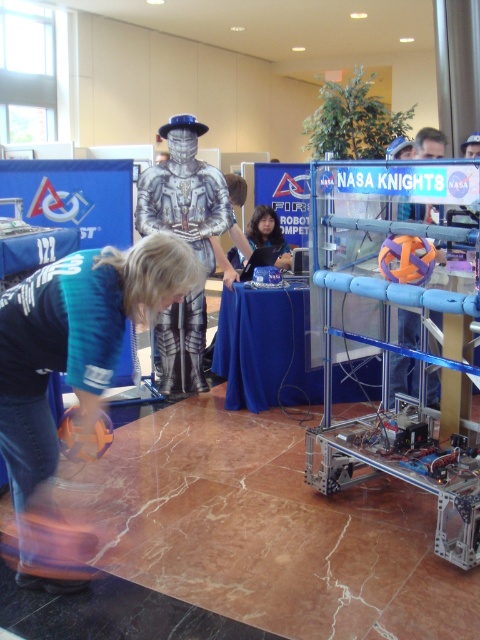
You are a judge at the robotics competition and need to determine if the orange matte ball at center can fit through a hoop that is just large enough for the smooth black hair at center. Can it pass through?

The orange matte ball at center is larger in size than smooth black hair at center, so it cannot pass through the hoop that fits the smooth black hair at center.

You are a photographer at the robotics event and want to take a photo that includes both the blue denim jeans at lower left and the smooth black hair at center. Which object should be placed to the left in the frame to ensure both are visible?

The blue denim jeans at lower left should be placed to the left in the frame because it is already positioned on the left side of the smooth black hair at center, ensuring both are visible.

You are a participant in the robotics competition and need to place a small orange and black ball on a platform located at point (11, 484). The platform is 7.14 feet away from you. Can you estimate if the ball will reach the platform if you roll it from your current position?

The platform at point (11, 484) is 7.14 feet away from you. If the ball can roll that distance, it will reach the platform. However, factors like the surface friction and the ball rolling force must be considered. The answer depends on those variables not provided here.